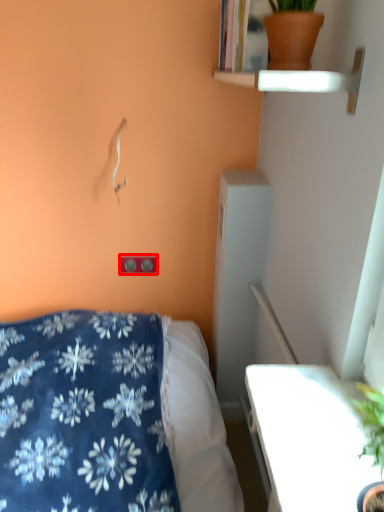
Question: From the image's perspective, where is electric outlet (annotated by the red box) located relative to flowerpot?

Choices:
 (A) above
 (B) below

Answer: (B)